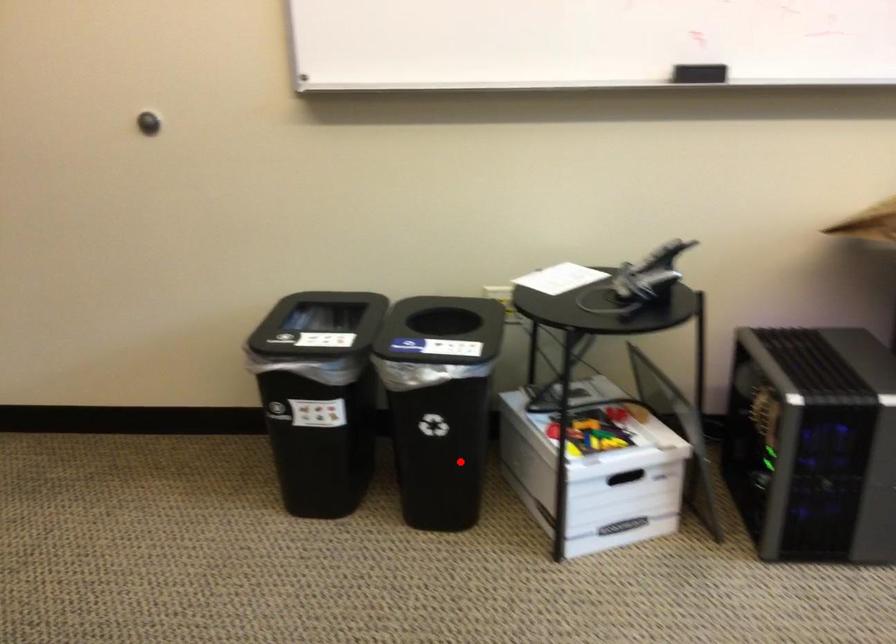
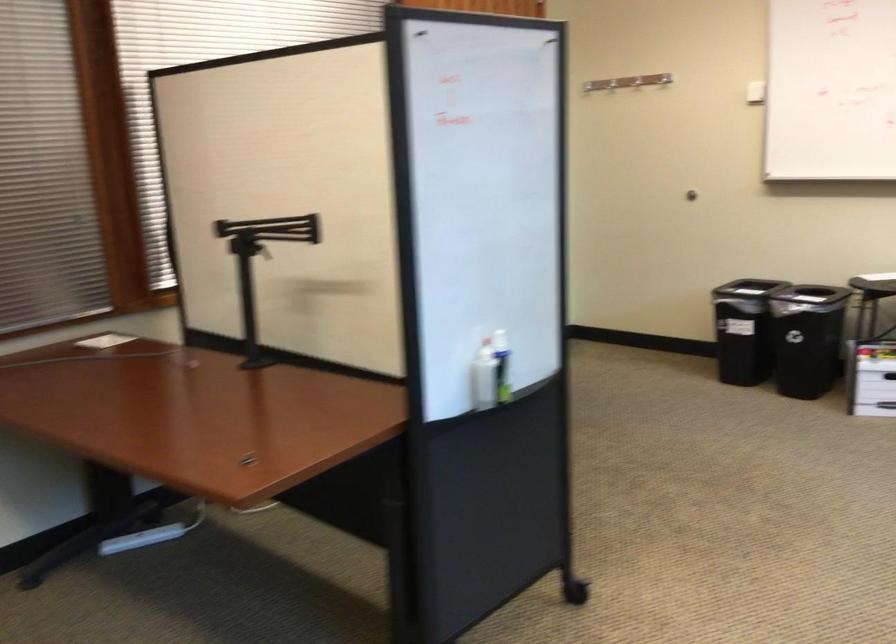
Where in the second image is the point corresponding to the highlighted location from the first image?

(744, 330)